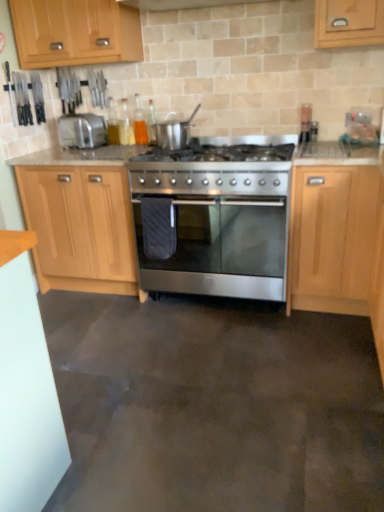
Question: In terms of size, does satin silver pot at center appear bigger or smaller than stainless steel oven at center?

Choices:
 (A) big
 (B) small

Answer: (B)

Question: From the image's perspective, is satin silver pot at center located above or below stainless steel oven at center?

Choices:
 (A) above
 (B) below

Answer: (A)

Question: Estimate the real-world distances between objects in this image. Which object is closer to the satin silver pot at center?

Choices:
 (A) glossy wood cabinet at center, which is counted as the third cabinetry, starting from the left
 (B) light wood/finish cabinet at upper left, which is the first cabinetry in left-to-right order
 (C) stainless steel gas stove at center
 (D) light wood/texture cabinet at left, placed as the 2th cabinetry when sorted from right to left
 (E) stainless steel oven at center

Answer: (C)

Question: Considering the real-world distances, which object is farthest from the glossy wood cabinet at center, which is counted as the first cabinetry, starting from the right?

Choices:
 (A) light wood/texture cabinet at left, placed as the 2th cabinetry when sorted from right to left
 (B) silver metallic toaster at left
 (C) light wood/finish cabinet at upper left, arranged as the third cabinetry when viewed from the right
 (D) satin silver pot at center
 (E) stainless steel oven at center

Answer: (B)